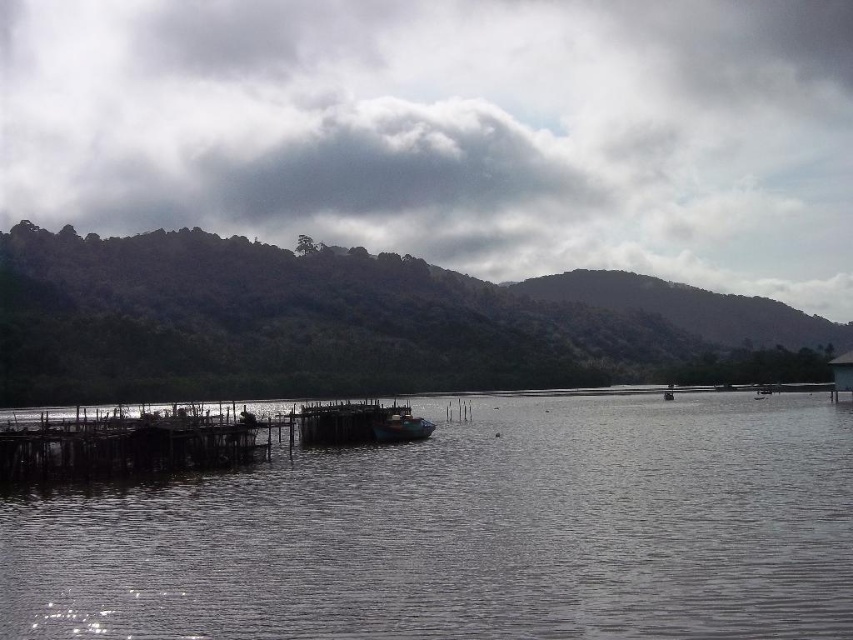
You are standing on the wooden dock at center and want to board the wooden boat at center. Based on the height difference between them, will you need to use a ladder or steps to get onto the boat?

The wooden dock at center is taller than the wooden boat at center, so you will need to use a ladder or steps to board the wooden boat at center from the wooden dock at center.

You are an astronomer trying to determine the position of the cloudy sky at upper center in the image. What are its coordinates?

The cloudy sky at upper center is located at coordinates (x=450, y=131).

You are a fisherman who wants to tie your wooden boat at center to the wooden dock at center. Based on the scene, can you determine if the dock will have enough space to accommodate your boat?

The wooden dock at center is wider than the wooden boat at center, so there should be enough space to accommodate the boat.